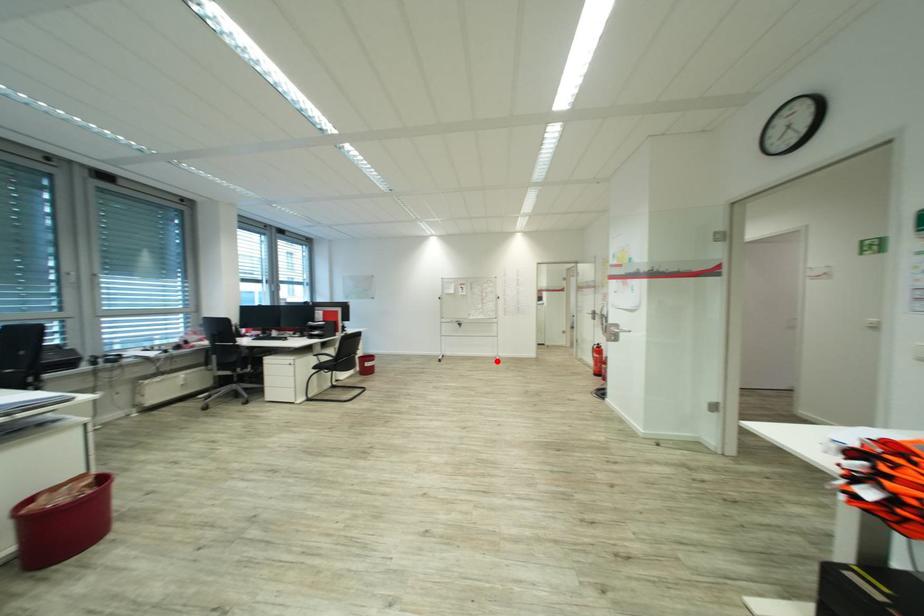
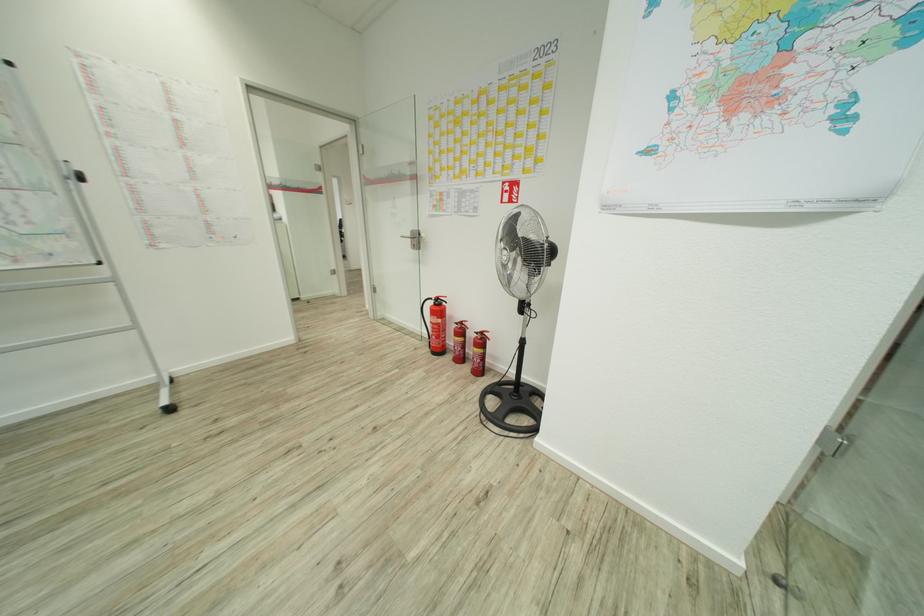
Question: I am providing you with two images of the same scene from different viewpoints. In image1, a red point is highlighted. Considering the same 3D point in image2, which of the following is correct?

Choices:
 (A) It is closer
 (B) It is farther

Answer: (A)